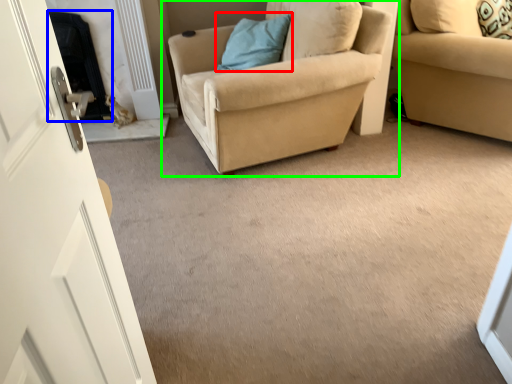
Question: Estimate the real-world distances between objects in this image. Which object is farther from pillow (highlighted by a red box), fireplace (highlighted by a blue box) or chair (highlighted by a green box)?

Choices:
 (A) fireplace
 (B) chair

Answer: (A)